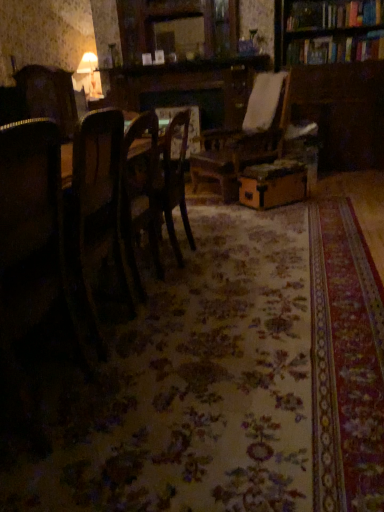
Question: Is dark wood chair at left, which is the second chair in front-to-back order, further to camera compared to wooden chair at center, arranged as the 3th chair when viewed from the front?

Choices:
 (A) yes
 (B) no

Answer: (B)

Question: Does dark wood chair at left, which is the second chair in front-to-back order, turn towards wooden chair at center, positioned as the first chair in back-to-front order?

Choices:
 (A) yes
 (B) no

Answer: (B)

Question: Can you confirm if dark wood chair at left, which is the second chair in front-to-back order, is shorter than wooden chair at center, arranged as the 3th chair when viewed from the front?

Choices:
 (A) yes
 (B) no

Answer: (A)

Question: From a real-world perspective, is dark wood chair at left, the second chair in the back-to-front sequence, under wooden chair at center, arranged as the 3th chair when viewed from the front?

Choices:
 (A) yes
 (B) no

Answer: (B)

Question: Can you confirm if dark wood chair at left, which is the second chair in front-to-back order, is taller than wooden chair at center, positioned as the first chair in back-to-front order?

Choices:
 (A) no
 (B) yes

Answer: (A)

Question: From the image's perspective, is wooden chair at center, positioned as the first chair in back-to-front order, positioned above or below wooden chair at left, which appears as the 1th chair when viewed from the front?

Choices:
 (A) below
 (B) above

Answer: (B)

Question: Is wooden chair at center, arranged as the 3th chair when viewed from the front, wider or thinner than wooden chair at left, which appears as the 1th chair when viewed from the front?

Choices:
 (A) thin
 (B) wide

Answer: (B)

Question: Is wooden chair at center, positioned as the first chair in back-to-front order, taller or shorter than wooden chair at left, which is the 3th chair from back to front?

Choices:
 (A) short
 (B) tall

Answer: (A)

Question: Does point (157, 146) appear closer or farther from the camera than point (28, 172)?

Choices:
 (A) farther
 (B) closer

Answer: (A)

Question: Is wooden bookcase at upper right situated inside wooden table at center or outside?

Choices:
 (A) inside
 (B) outside

Answer: (B)

Question: Is point (372, 44) closer or farther from the camera than point (165, 142)?

Choices:
 (A) farther
 (B) closer

Answer: (A)

Question: Looking at their shapes, would you say wooden bookcase at upper right is wider or thinner than wooden table at center?

Choices:
 (A) wide
 (B) thin

Answer: (A)

Question: Would you say wooden bookcase at upper right is to the left or to the right of wooden table at center in the picture?

Choices:
 (A) right
 (B) left

Answer: (A)

Question: In terms of height, does dark wood chair at left, which is the second chair in front-to-back order, look taller or shorter compared to brown cardboard box at center?

Choices:
 (A) tall
 (B) short

Answer: (A)

Question: In terms of width, does dark wood chair at left, the second chair in the back-to-front sequence, look wider or thinner when compared to brown cardboard box at center?

Choices:
 (A) wide
 (B) thin

Answer: (B)